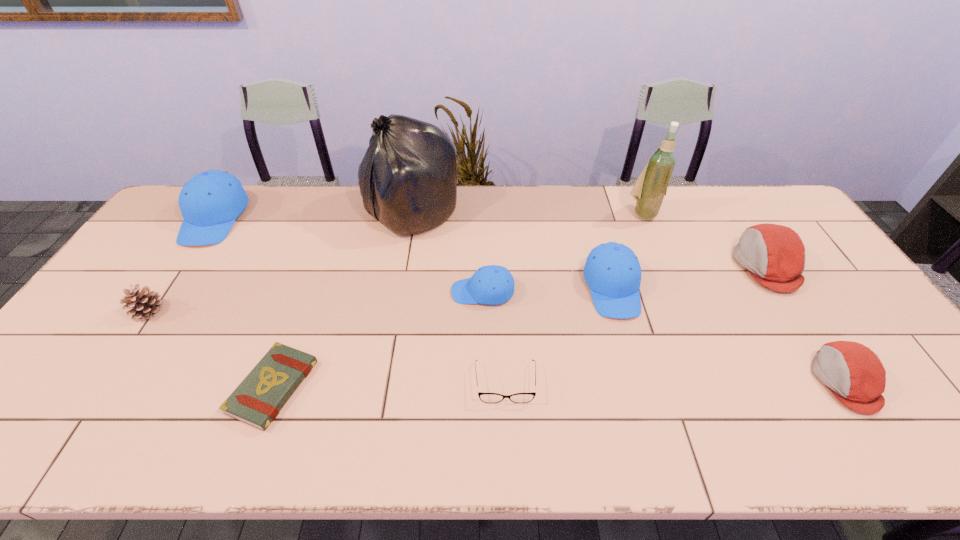
Find the location of `vacant space at the far edge of the desktop`. vacant space at the far edge of the desktop is located at coordinates (285, 227).

The width and height of the screenshot is (960, 540). What are the coordinates of `vacant space at the near edge` in the screenshot? It's located at (602, 427).

Where is `vacant space at the left edge`? vacant space at the left edge is located at coordinates (148, 273).

Where is `free space at the right edge of the desktop`? The width and height of the screenshot is (960, 540). free space at the right edge of the desktop is located at coordinates (873, 326).

You are a GUI agent. You are given a task and a screenshot of the screen. Output one action in this format:
    pyautogui.click(x=<x>, y=<y>)
    Task: Click on the vacant space at the near left corner of the desktop
    The width and height of the screenshot is (960, 540).
    Given the screenshot: What is the action you would take?
    pyautogui.click(x=51, y=439)

The image size is (960, 540). In order to click on vacant space at the near right corner of the desktop in this screenshot , I will do `click(890, 416)`.

At what (x,y) coordinates should I click in order to perform the action: click on free space between the brown book and the plastic bag. Please return your answer as a coordinate pair (x, y). This screenshot has height=540, width=960. Looking at the image, I should click on (342, 300).

Image resolution: width=960 pixels, height=540 pixels. What are the coordinates of `free space between the fourth cap from right to left and the plastic bag` in the screenshot? It's located at (446, 252).

This screenshot has width=960, height=540. Identify the location of free space between the brown book and the third cap from right to left. (443, 338).

You are a GUI agent. You are given a task and a screenshot of the screen. Output one action in this format:
    pyautogui.click(x=<x>, y=<y>)
    Task: Click on the free space that is in between the second blue cap from left to right and the nearest cap
    This screenshot has height=540, width=960.
    Given the screenshot: What is the action you would take?
    pyautogui.click(x=663, y=336)